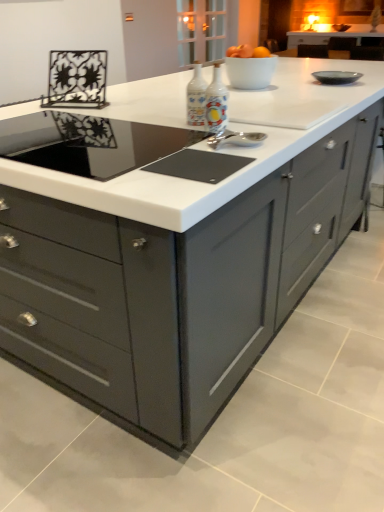
You are a GUI agent. You are given a task and a screenshot of the screen. Output one action in this format:
    pyautogui.click(x=<x>, y=<y>)
    Task: Click on the free space in front of matte glass bottles at center, positioned as the first appliance in left-to-right order
    The height and width of the screenshot is (512, 384).
    Given the screenshot: What is the action you would take?
    pyautogui.click(x=205, y=133)